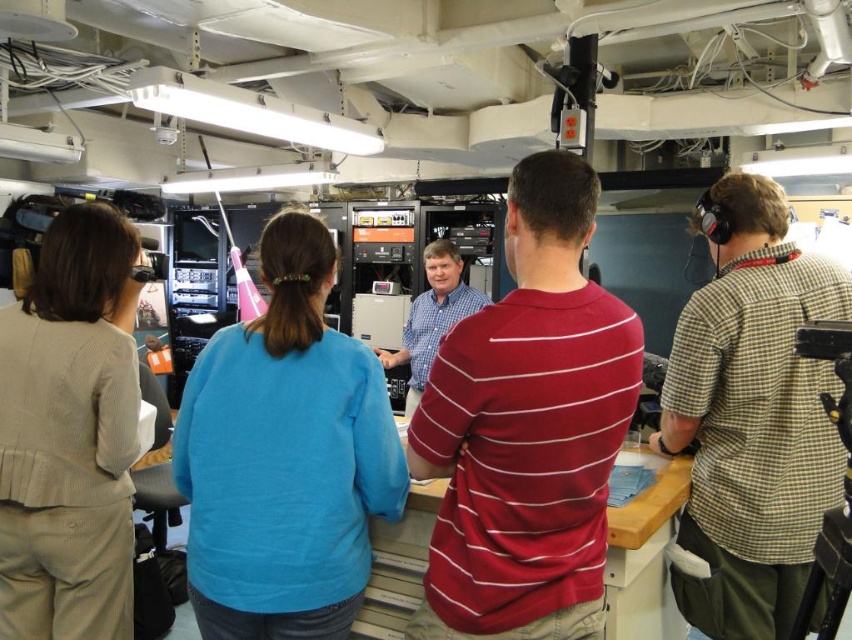
Question: Which of the following is the closest to the observer?

Choices:
 (A) (770, 461)
 (B) (573, 157)
 (C) (827, 545)

Answer: (B)

Question: Which object appears farthest from the camera in this image?

Choices:
 (A) red striped shirt at center
 (B) blue plaid shirt at center
 (C) black plastic tripod at right

Answer: (B)

Question: Which object is positioned farthest from the checkered fabric shirt at right?

Choices:
 (A) red striped shirt at center
 (B) blue plaid shirt at center

Answer: (B)

Question: Can you confirm if red striped shirt at center is smaller than checkered fabric shirt at right?

Choices:
 (A) yes
 (B) no

Answer: (A)

Question: Considering the relative positions of black plastic tripod at right and blue plaid shirt at center in the image provided, where is black plastic tripod at right located with respect to blue plaid shirt at center?

Choices:
 (A) above
 (B) below

Answer: (B)

Question: Can you confirm if checkered fabric shirt at right is smaller than black plastic tripod at right?

Choices:
 (A) no
 (B) yes

Answer: (A)